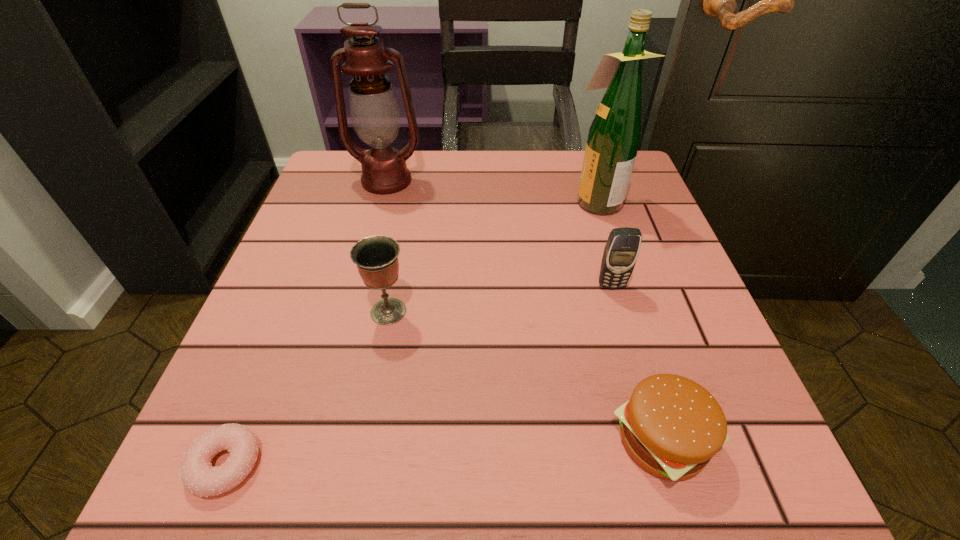
Find the location of a particular element. The image size is (960, 540). liquor present at the right edge is located at coordinates (614, 136).

The width and height of the screenshot is (960, 540). In order to click on cellular telephone that is positioned at the right edge in this screenshot , I will do `click(621, 251)`.

What are the coordinates of `hamburger positioned at the right edge` in the screenshot? It's located at (671, 426).

The height and width of the screenshot is (540, 960). I want to click on object situated at the far left corner, so click(x=374, y=110).

Locate an element on the screen. object present at the near left corner is located at coordinates (198, 476).

Where is `object that is positioned at the far right corner`? The width and height of the screenshot is (960, 540). object that is positioned at the far right corner is located at coordinates (614, 136).

Where is `object that is at the near right corner`? object that is at the near right corner is located at coordinates (671, 426).

The height and width of the screenshot is (540, 960). Identify the location of vacant region at the far edge of the desktop. (568, 181).

The width and height of the screenshot is (960, 540). Identify the location of free region at the near edge of the desktop. (420, 476).

Locate an element on the screen. This screenshot has height=540, width=960. free spot at the left edge of the desktop is located at coordinates (334, 303).